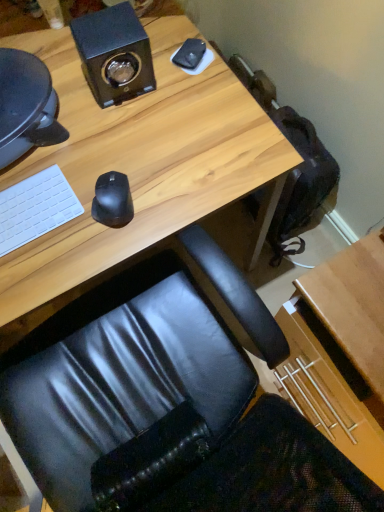
Find the location of a particular element. This screenshot has width=384, height=512. free location in front of white matte keyboard at left is located at coordinates (26, 275).